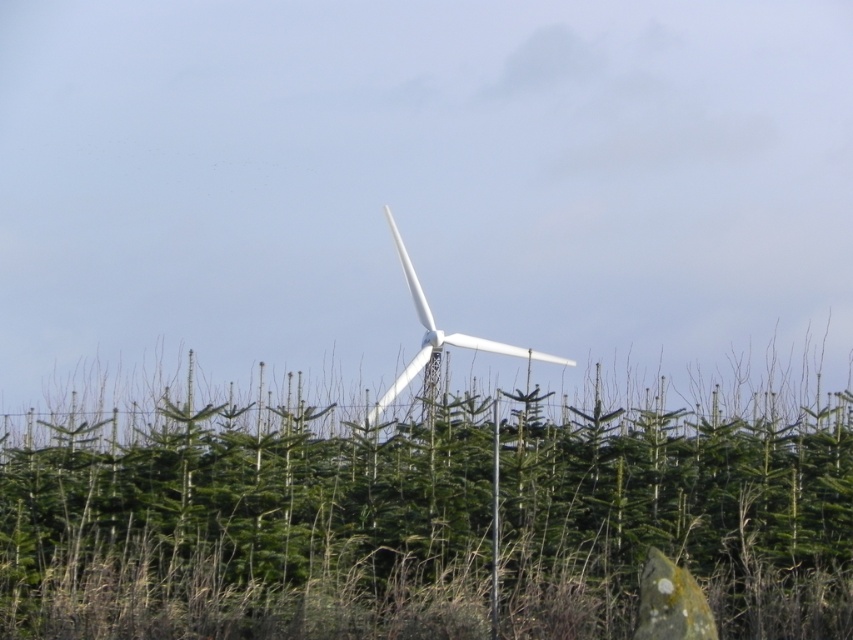
Who is more forward, [828,614] or [416,289]?

Positioned in front is point [828,614].

Where is `green matte tree at center`? This screenshot has height=640, width=853. green matte tree at center is located at coordinates (426, 508).